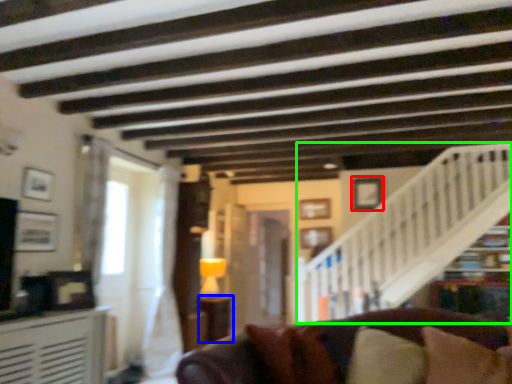
Question: Based on their relative distances, which object is farther from picture frame (highlighted by a red box)? Choose from table (highlighted by a blue box) and stairwell (highlighted by a green box).

Choices:
 (A) table
 (B) stairwell

Answer: (A)